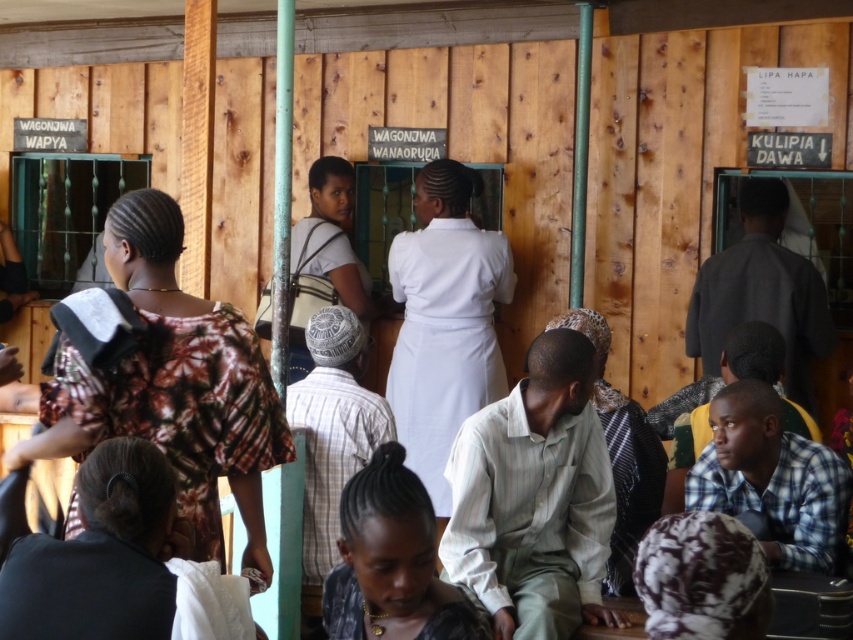
Is the position of printed fabric dress at left less distant than that of light brown fabric headscarf at lower center?

That is True.

Measure the distance between printed fabric dress at left and camera.

A distance of 13.09 feet exists between printed fabric dress at left and camera.

The width and height of the screenshot is (853, 640). What are the coordinates of `printed fabric dress at left` in the screenshot? It's located at (170, 385).

Can you confirm if white smooth uniform at center is bigger than black textured hair at center?

Indeed, white smooth uniform at center has a larger size compared to black textured hair at center.

Which of these two, white smooth uniform at center or black textured hair at center, stands shorter?

black textured hair at center is shorter.

Who is more forward, (474,275) or (450,604)?

Point (450,604) is in front.

Find the location of `white smooth uniform at center`. white smooth uniform at center is located at coordinates 444,321.

Is white smooth uniform at center shorter than light brown fabric headscarf at lower center?

No, white smooth uniform at center is not shorter than light brown fabric headscarf at lower center.

This screenshot has width=853, height=640. What do you see at coordinates (444, 321) in the screenshot?
I see `white smooth uniform at center` at bounding box center [444, 321].

Describe the element at coordinates (444, 321) in the screenshot. I see `white smooth uniform at center` at that location.

In order to click on white smooth uniform at center in this screenshot , I will do `click(444, 321)`.